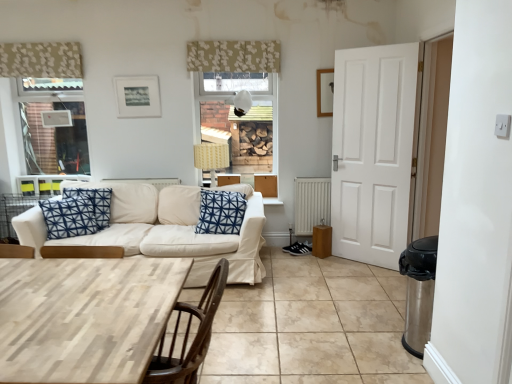
Question: Considering the positions of wooden picture frame at upper right, marked as the second picture frame in a left-to-right arrangement, and blue printed cushion at center in the image, is wooden picture frame at upper right, marked as the second picture frame in a left-to-right arrangement, wider or thinner than blue printed cushion at center?

Choices:
 (A) thin
 (B) wide

Answer: (A)

Question: In terms of height, does wooden picture frame at upper right, positioned as the 1th picture frame in right-to-left order, look taller or shorter compared to blue printed cushion at center?

Choices:
 (A) short
 (B) tall

Answer: (A)

Question: Considering the real-world distances, which object is farthest from the beige tile at lower center?

Choices:
 (A) patterned fabric curtain at upper left, which is the 2th curtain in right-to-left order
 (B) floral fabric curtain at upper center, which is the first curtain in right-to-left order
 (C) white fabric couch at center
 (D) wooden picture frame at upper right, positioned as the 1th picture frame in right-to-left order
 (E) white glossy door at right

Answer: (A)

Question: Estimate the real-world distances between objects in this image. Which object is farther from the matte black picture frame at upper center, positioned as the 2th picture frame in right-to-left order?

Choices:
 (A) blue printed cushion at center
 (B) patterned fabric curtain at upper left, the first curtain viewed from the left
 (C) white metallic radiator at lower center
 (D) floral fabric curtain at upper center, which is the first curtain in right-to-left order
 (E) beige tile at lower center

Answer: (E)